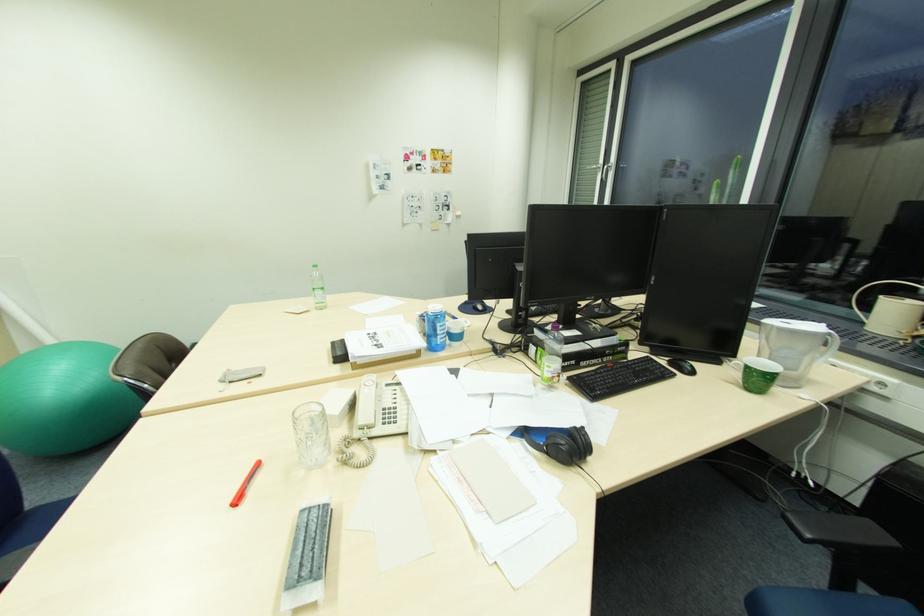
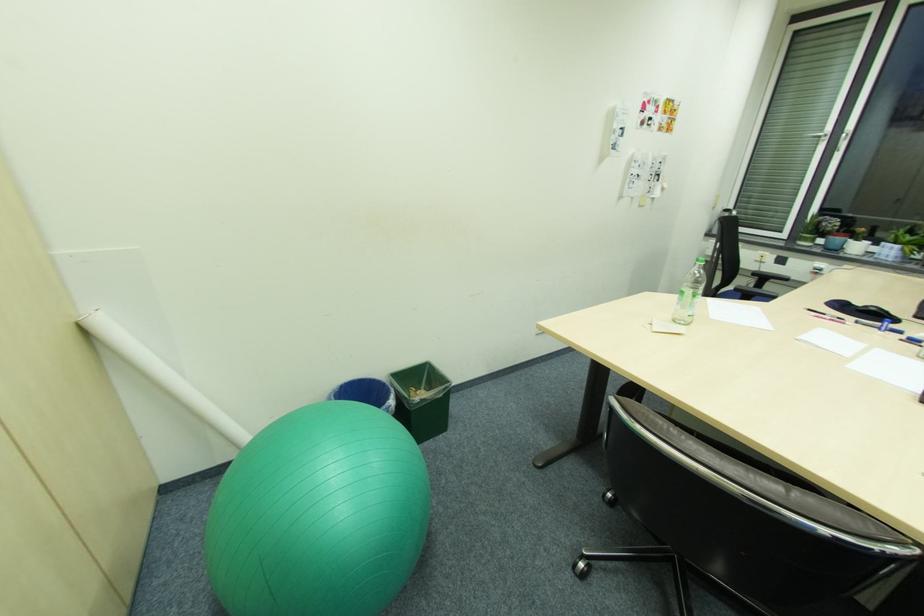
Which direction would the cameraman need to move to produce the second image?

The cameraman moved toward left, forward.